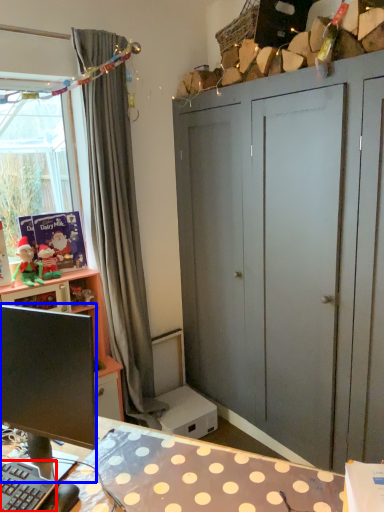
Question: Which point is further to the camera, computer keyboard (highlighted by a red box) or computer monitor (highlighted by a blue box)?

Choices:
 (A) computer keyboard
 (B) computer monitor

Answer: (A)